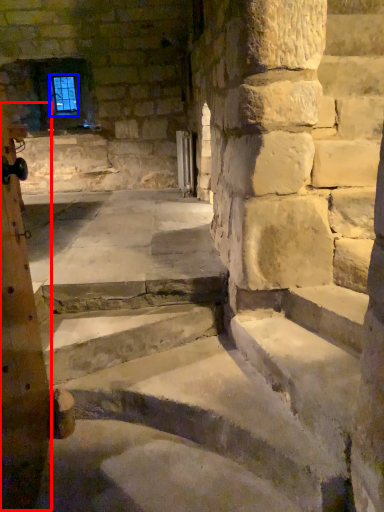
Question: Which object appears closest to the camera in this image, pillar (highlighted by a red box) or window screen (highlighted by a blue box)?

Choices:
 (A) pillar
 (B) window screen

Answer: (A)